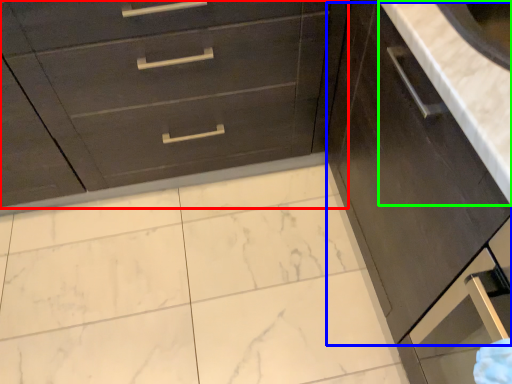
Question: Based on their relative distances, which object is farther from chest of drawers (highlighted by a red box)? Choose from cabinetry (highlighted by a blue box) and counter top (highlighted by a green box).

Choices:
 (A) cabinetry
 (B) counter top

Answer: (B)